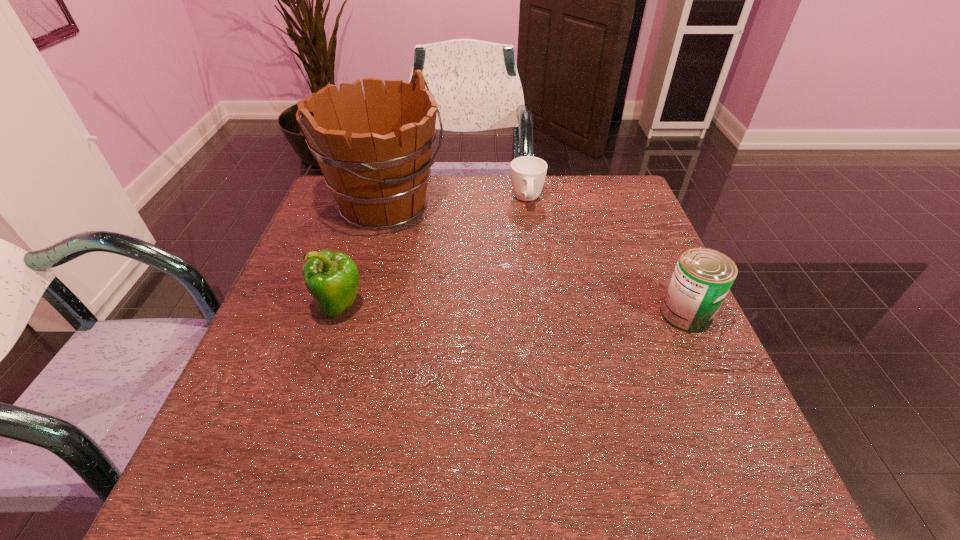
Identify the location of free space on the desktop that is between the bell pepper and the rightmost object and is positioned with the handle on the side of the second object from right to left. Image resolution: width=960 pixels, height=540 pixels. (541, 311).

You are a GUI agent. You are given a task and a screenshot of the screen. Output one action in this format:
    pyautogui.click(x=<x>, y=<y>)
    Task: Click on the vacant space on the desktop that is between the second tallest object and the can and is positioned with the handle on the tallest object
    
    Given the screenshot: What is the action you would take?
    pyautogui.click(x=545, y=311)